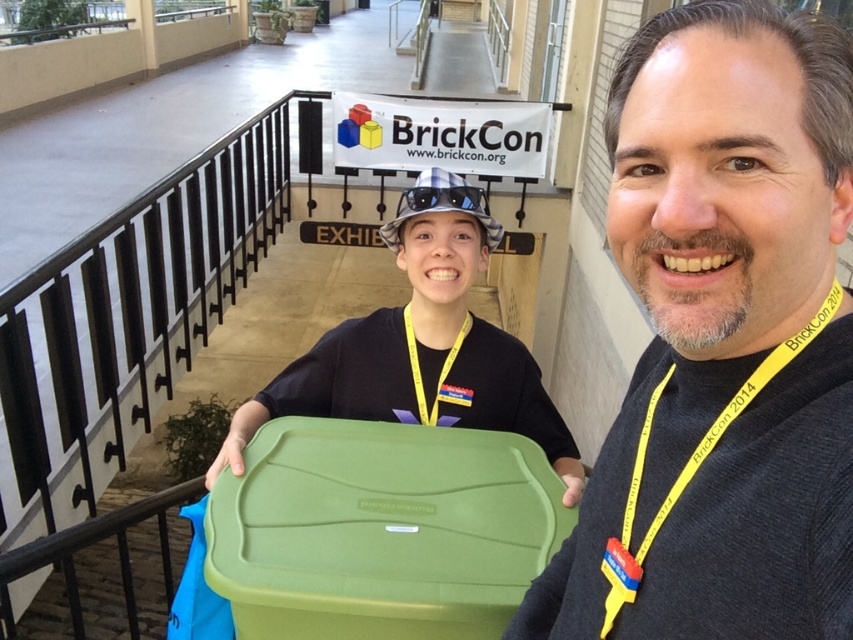
Is matte black shirt at center smaller than green plastic bin at center?

Correct, matte black shirt at center occupies less space than green plastic bin at center.

Does matte black shirt at center have a larger size compared to green plastic bin at center?

No.

Is point (838, 381) farther from camera compared to point (554, 467)?

No, it is in front of (554, 467).

Locate an element on the screen. matte black shirt at center is located at coordinates coord(722,342).